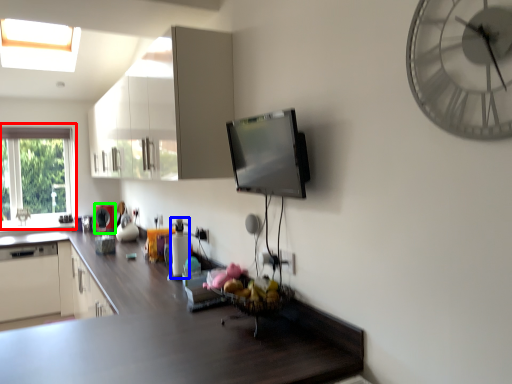
Question: Which is farther away from window (highlighted by a red box)? appliance (highlighted by a blue box) or appliance (highlighted by a green box)?

Choices:
 (A) appliance
 (B) appliance

Answer: (A)